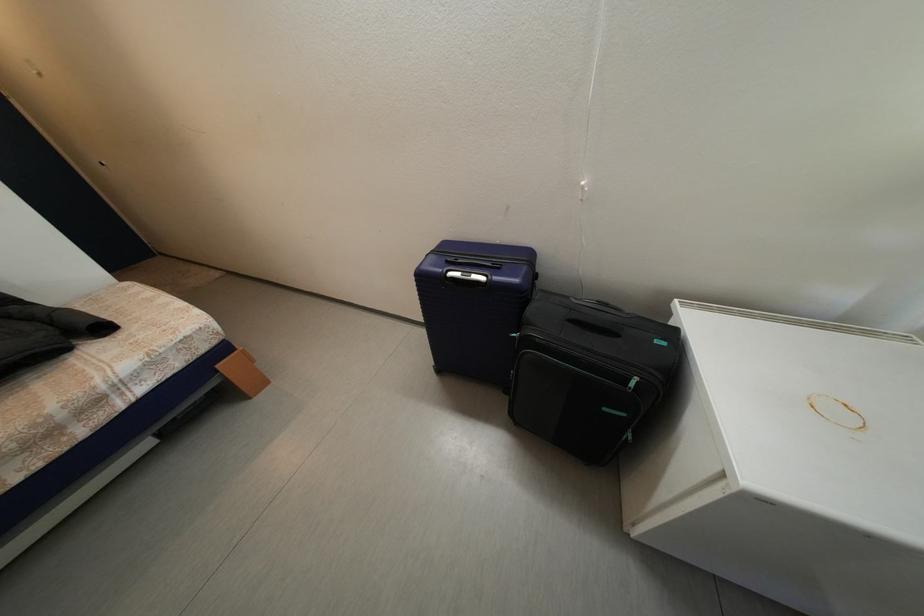
The image size is (924, 616). What are the coordinates of `black suitcase handle` in the screenshot? It's located at (593, 325).